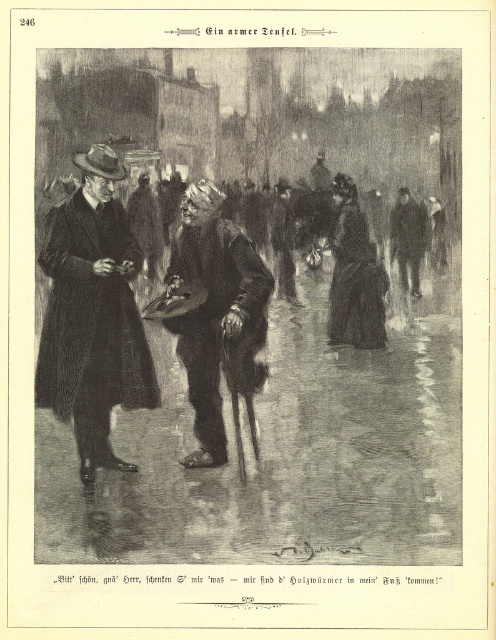
Question: Can you confirm if coarse wool coat at left is bigger than dark gray wool hat at center?

Choices:
 (A) yes
 (B) no

Answer: (A)

Question: Which of these objects is positioned farthest from the dark gray wool hat at center?

Choices:
 (A) coarse wool coat at left
 (B) smooth black coat at center

Answer: (B)

Question: Is smooth black coat at center above dark gray wool hat at center?

Choices:
 (A) yes
 (B) no

Answer: (A)

Question: Where is smooth black coat at center located in relation to coarse wool coat at left in the image?

Choices:
 (A) above
 (B) below

Answer: (A)

Question: Which of the following is the farthest from the observer?

Choices:
 (A) smooth black coat at center
 (B) dark gray wool hat at center
 (C) coarse wool coat at left

Answer: (C)

Question: Which point appears closest to the camera in this image?

Choices:
 (A) (135, 384)
 (B) (424, 538)

Answer: (B)